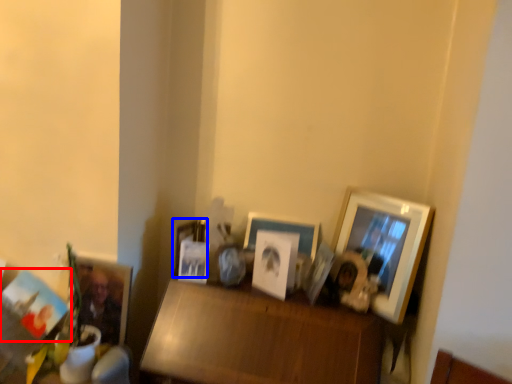
Question: Which point is closer to the camera, picture frame (highlighted by a red box) or picture frame (highlighted by a blue box)?

Choices:
 (A) picture frame
 (B) picture frame

Answer: (A)